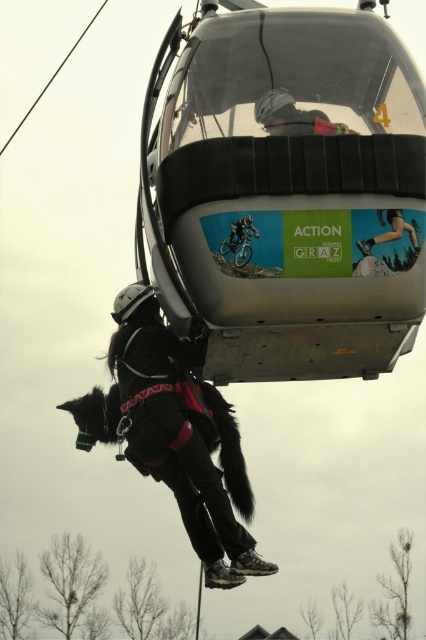
In the scene shown: You are a safety inspector reviewing the rappelling operation from the silver metallic cable car at upper center. You notice the smooth skin at center belongs to the rappeller. Based on the size comparison between the two, can you determine if the rappeller is positioned correctly for a safe descent?

The silver metallic cable car at upper center is larger in size than the smooth skin at center, indicating the rappeller is positioned correctly as the car provides sufficient space for a safe descent.